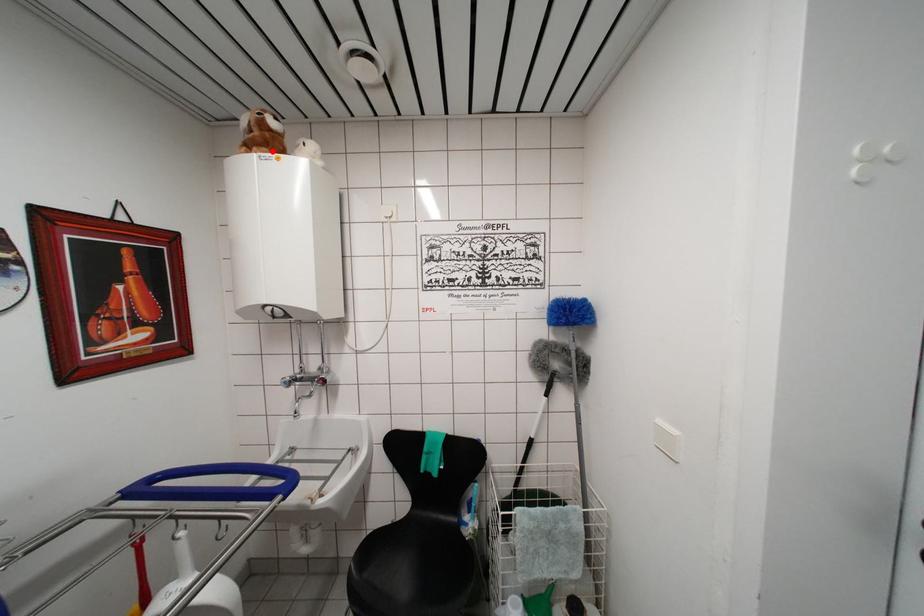
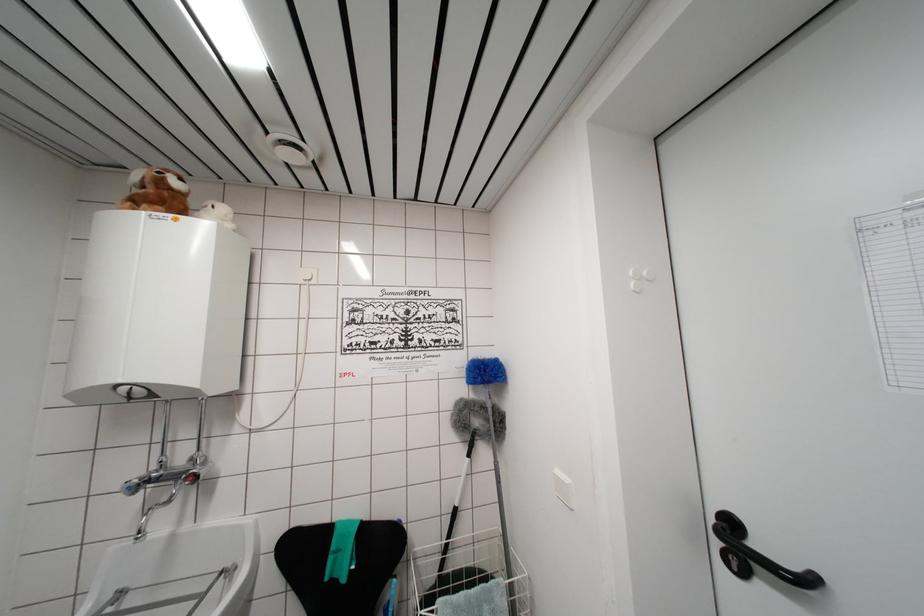
Question: I am providing you with two images of the same scene from different viewpoints. A red point is marked on the first image. Can you still see the location of the red point in image 2?

Choices:
 (A) Yes
 (B) No

Answer: (A)